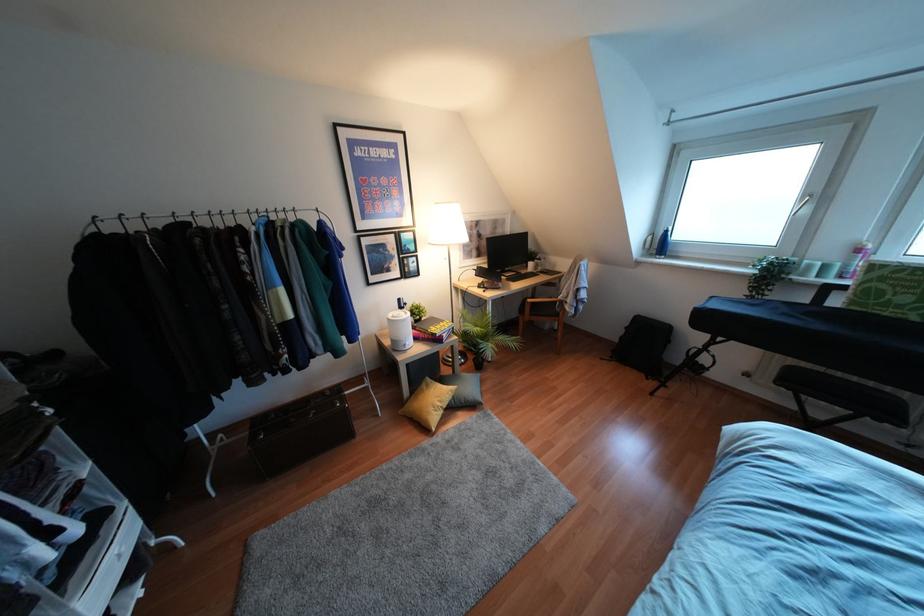
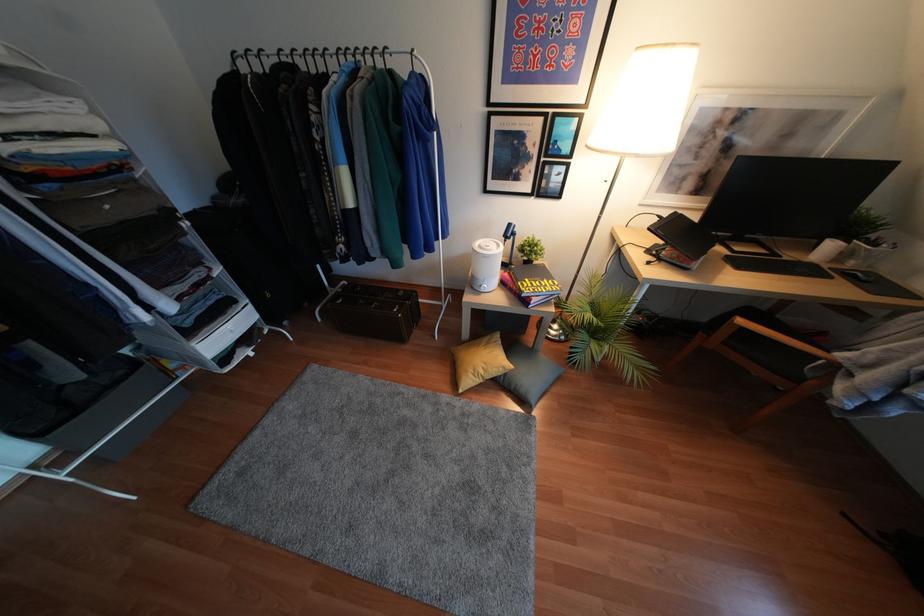
The point at (417, 302) is marked in the first image. Where is the corresponding point in the second image?

(536, 237)